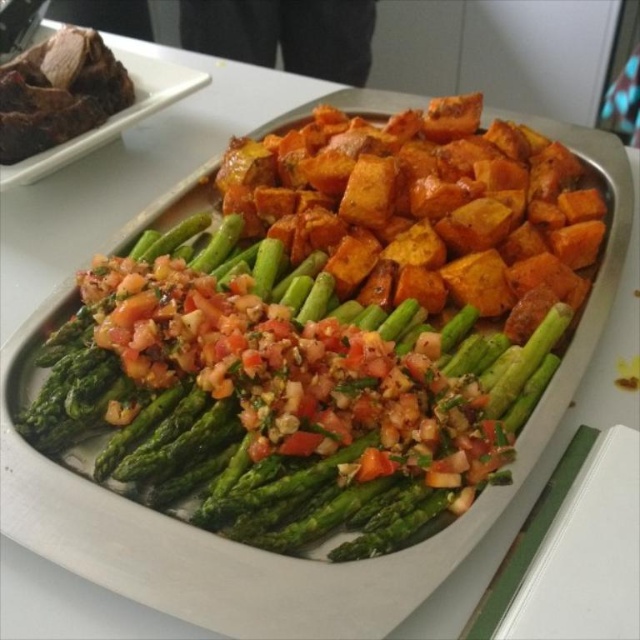
Question: Can you confirm if green glossy asparagus at center is positioned to the left of dark brown meat at upper left?

Choices:
 (A) yes
 (B) no

Answer: (B)

Question: Which of the following is the closest to the observer?

Choices:
 (A) tap(460, 444)
 (B) tap(68, 113)

Answer: (A)

Question: Can you confirm if green glossy asparagus at center is bigger than dark brown meat at upper left?

Choices:
 (A) no
 (B) yes

Answer: (B)

Question: Does green glossy asparagus at center have a greater width compared to dark brown meat at upper left?

Choices:
 (A) no
 (B) yes

Answer: (B)

Question: Among these points, which one is farthest from the camera?

Choices:
 (A) (376, 308)
 (B) (10, 68)

Answer: (B)